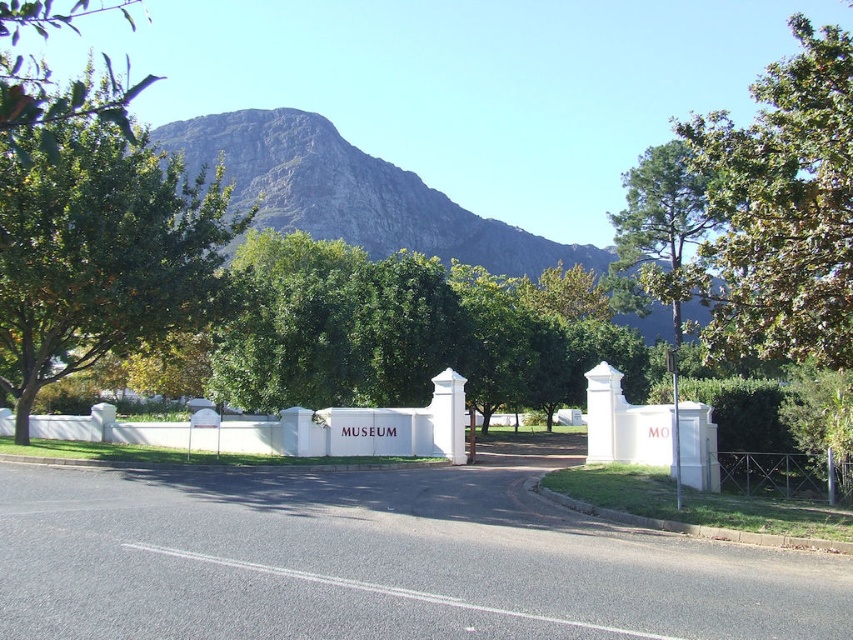
You are a landscape architect designing a walking path between the green leafy tree at upper right and the green leafy hedge at center. What is the minimum length the path should be to connect them?

The green leafy tree at upper right and green leafy hedge at center are 7.92 meters apart, so the path should be at least 7.92 meters long to connect them.